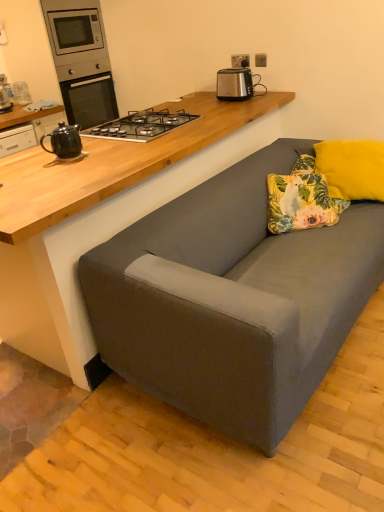
The height and width of the screenshot is (512, 384). I want to click on free space in front of satin silver toaster at upper center, so click(x=242, y=101).